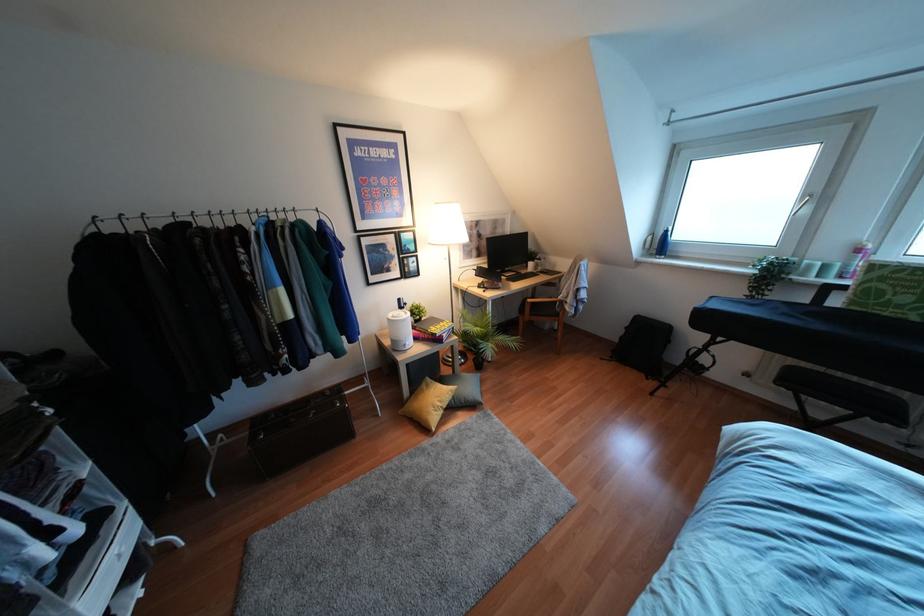
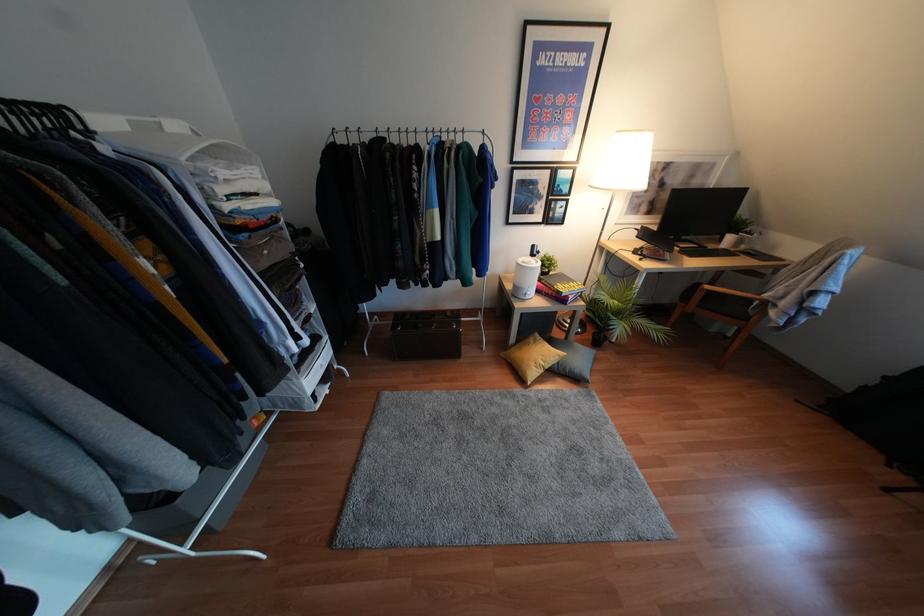
Find the pixel in the second image that matches [453,397] in the first image.

(556, 362)